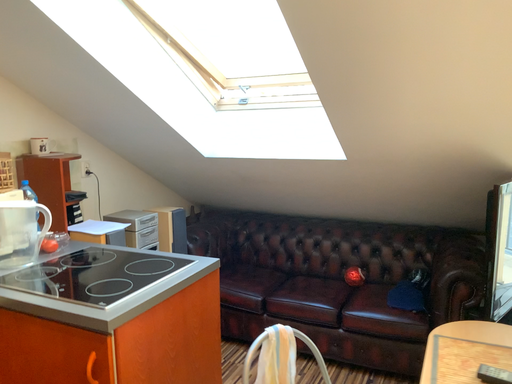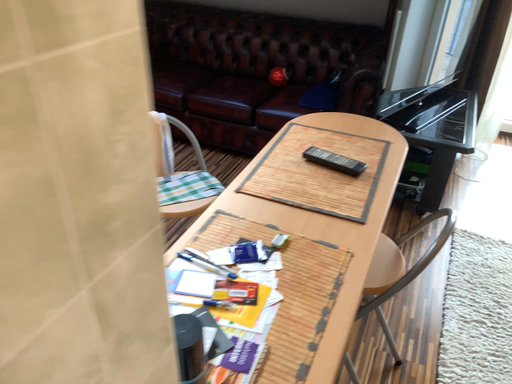
Question: How did the camera likely rotate when shooting the video?

Choices:
 (A) rotated downward
 (B) rotated upward

Answer: (A)